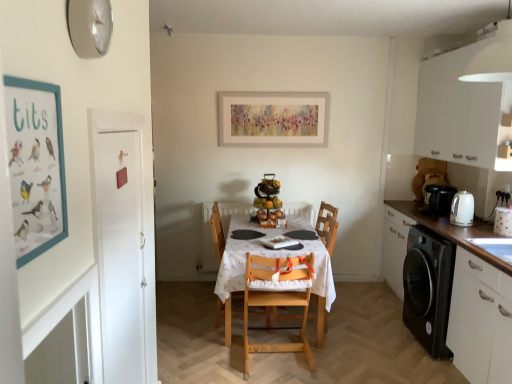
Identify the location of vacant space to the right of wooden highchair at center. The height and width of the screenshot is (384, 512). (353, 323).